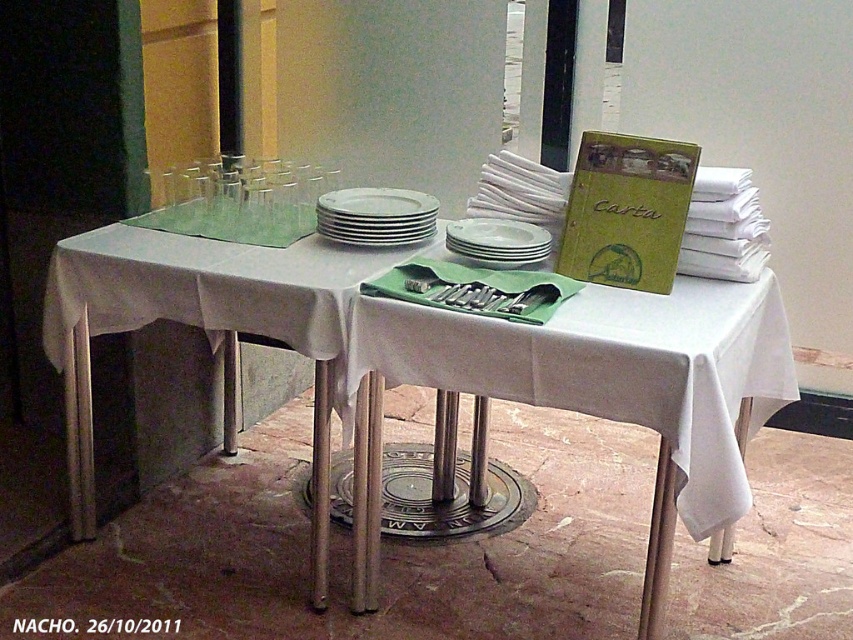
Question: Which point is closer to the camera taking this photo?

Choices:
 (A) (524, 243)
 (B) (463, 316)
 (C) (399, 188)

Answer: (B)

Question: Can you confirm if white glossy plates at center is positioned above white matte plate at center?

Choices:
 (A) yes
 (B) no

Answer: (A)

Question: Is white glossy plates at center to the right of white matte plate at center from the viewer's perspective?

Choices:
 (A) no
 (B) yes

Answer: (A)

Question: Is white glossy plates at center to the right of white matte plate at center from the viewer's perspective?

Choices:
 (A) yes
 (B) no

Answer: (B)

Question: Which of the following is the farthest from the observer?

Choices:
 (A) white cloth table at center
 (B) white matte plate at center
 (C) white glossy plates at center

Answer: (C)

Question: Which point is farther to the camera?

Choices:
 (A) (486, 250)
 (B) (643, 426)

Answer: (A)